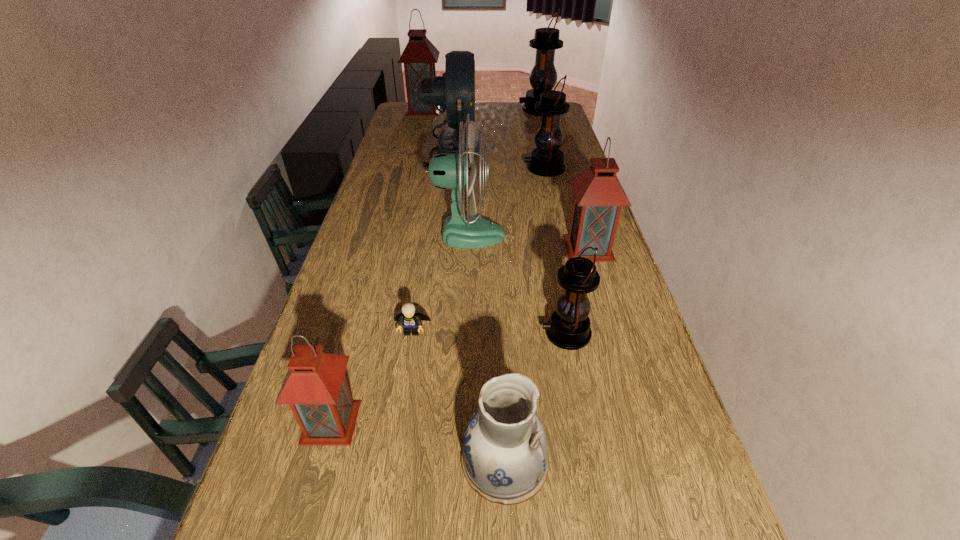
The image size is (960, 540). Find the location of `the smallest pink lantern`. the smallest pink lantern is located at coordinates (315, 387).

Image resolution: width=960 pixels, height=540 pixels. What are the coordinates of `the nearest pink lantern` in the screenshot? It's located at (315, 387).

This screenshot has width=960, height=540. I want to click on the ninth tallest object, so [504, 458].

I want to click on pottery, so click(x=504, y=458).

Where is `Lego`? Image resolution: width=960 pixels, height=540 pixels. Lego is located at coordinates (410, 320).

Identify a few spots in the free region located 0.150m above the farthest black lantern, indicating its light source. Please provide its 2D coordinates. Your answer should be formatted as a tuple, i.e. [(x, y)], where the tuple contains the x and y coordinates of a point satisfying the conditions above.

[(490, 109)]

Identify some points within the free space located above the farthest black lantern, indicating its light source. Please provide its 2D coordinates. Your answer should be formatted as a tuple, i.e. [(x, y)], where the tuple contains the x and y coordinates of a point satisfying the conditions above.

[(454, 109)]

Select a few points in free space located above the farthest black lantern, indicating its light source. Please provide its 2D coordinates. Your answer should be formatted as a tuple, i.e. [(x, y)], where the tuple contains the x and y coordinates of a point satisfying the conditions above.

[(443, 109)]

Locate an element on the screen. free space located 0.380m on the right of the biggest pink lantern is located at coordinates click(x=516, y=109).

Find the location of `free space located 0.400m in front of the blue fan to blow air`. free space located 0.400m in front of the blue fan to blow air is located at coordinates [573, 148].